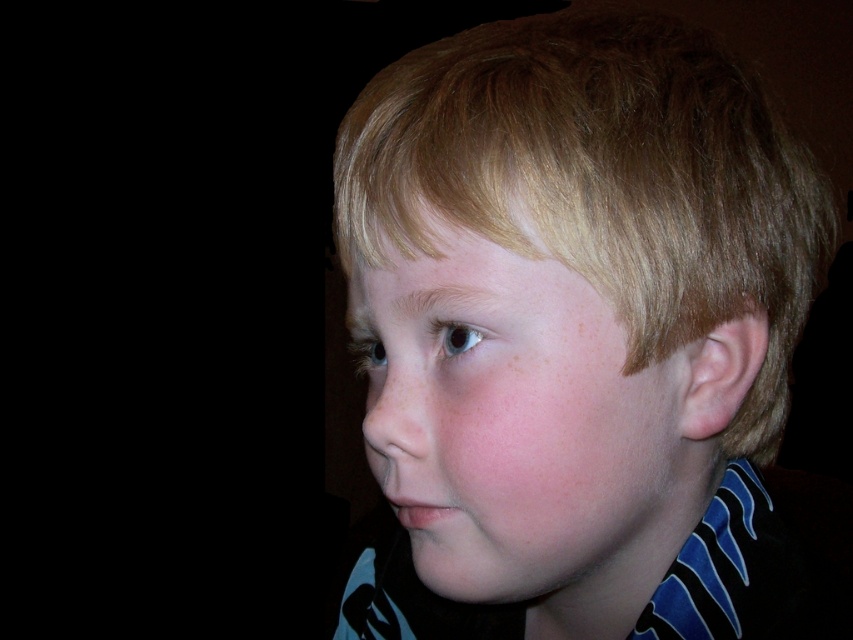
Question: Is smooth skin child at center bigger than smooth skin face at center?

Choices:
 (A) no
 (B) yes

Answer: (B)

Question: Which point is closer to the camera?

Choices:
 (A) pink matte freckle at upper center
 (B) smooth skin child at center
 (C) smooth skin face at center

Answer: (B)

Question: Can you confirm if smooth skin face at center is positioned to the left of pink matte freckle at upper center?

Choices:
 (A) yes
 (B) no

Answer: (B)

Question: Is smooth skin face at center smaller than pink matte freckle at upper center?

Choices:
 (A) yes
 (B) no

Answer: (B)

Question: Which of the following is the closest to the observer?

Choices:
 (A) smooth skin face at center
 (B) smooth skin child at center
 (C) pink matte freckle at upper center

Answer: (B)

Question: Which of the following is the farthest from the observer?

Choices:
 (A) smooth skin child at center
 (B) smooth skin face at center
 (C) pink matte freckle at upper center

Answer: (C)